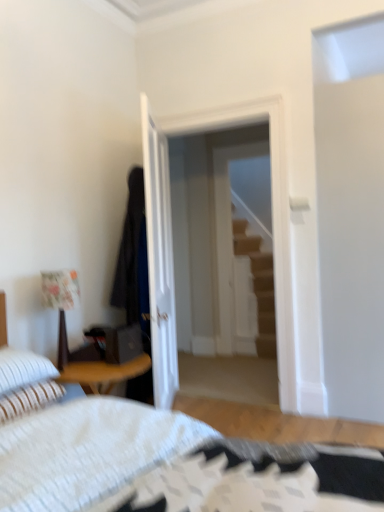
This screenshot has height=512, width=384. What are the coordinates of `vacant space underneath wooden staircase at center (from a real-world perspective)` in the screenshot? It's located at (260, 355).